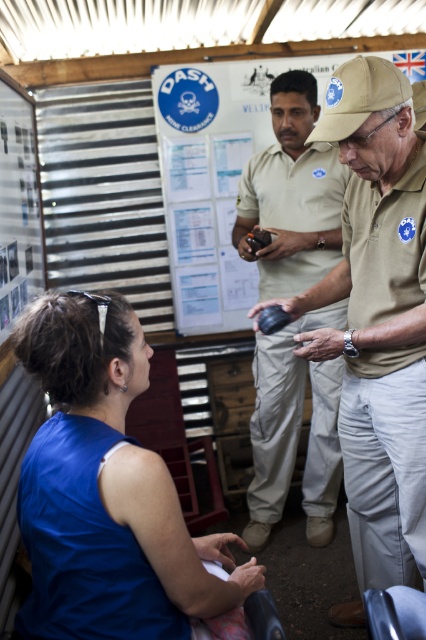
Can you confirm if beige uniform at center is thinner than tan fabric baseball cap at center?

No, beige uniform at center is not thinner than tan fabric baseball cap at center.

Between beige uniform at center and tan fabric baseball cap at center, which one has more height?

With more height is beige uniform at center.

The height and width of the screenshot is (640, 426). What do you see at coordinates (291, 195) in the screenshot? I see `beige uniform at center` at bounding box center [291, 195].

Locate an element on the screen. The height and width of the screenshot is (640, 426). beige uniform at center is located at coordinates (291, 195).

Is tan uniform at center thinner than tan fabric baseball cap at center?

In fact, tan uniform at center might be wider than tan fabric baseball cap at center.

Between tan uniform at center and tan fabric baseball cap at center, which one is positioned higher?

tan fabric baseball cap at center

Does point (412, 300) come closer to viewer compared to point (336, 108)?

No, (412, 300) is behind (336, 108).

What are the coordinates of `tan uniform at center` in the screenshot? It's located at (377, 317).

Which is in front, point (104, 326) or point (310, 438)?

Point (104, 326)

Locate an element on the screen. The height and width of the screenshot is (640, 426). blue sleeveless top at lower left is located at coordinates (106, 492).